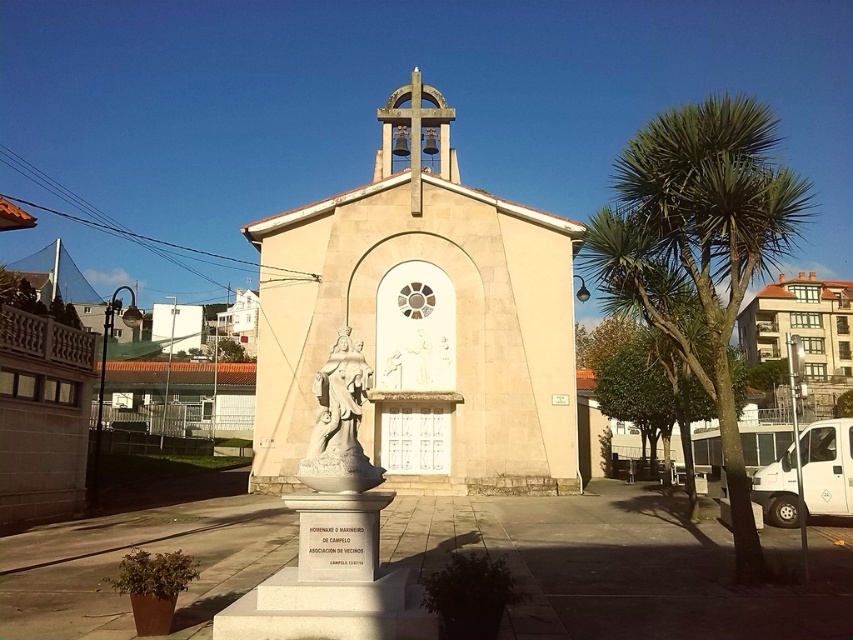
Does green leafy palm tree at right have a greater width compared to beige stone church at center?

No.

Does green leafy palm tree at right have a smaller size compared to beige stone church at center?

No, green leafy palm tree at right is not smaller than beige stone church at center.

This screenshot has width=853, height=640. What do you see at coordinates (700, 250) in the screenshot?
I see `green leafy palm tree at right` at bounding box center [700, 250].

Locate an element on the screen. green leafy palm tree at right is located at coordinates (700, 250).

Is green leafy palm tree at right wider than white stone statue at center?

Yes.

Does green leafy palm tree at right appear over white stone statue at center?

Indeed, green leafy palm tree at right is positioned over white stone statue at center.

What do you see at coordinates (700, 250) in the screenshot?
I see `green leafy palm tree at right` at bounding box center [700, 250].

Identify the location of green leafy palm tree at right. The height and width of the screenshot is (640, 853). (700, 250).

Which is above, beige stone chapel at center or beige stone church at center?

beige stone church at center

Is the position of beige stone chapel at center more distant than that of beige stone church at center?

→ No, it is in front of beige stone church at center.

What do you see at coordinates (422, 321) in the screenshot? Image resolution: width=853 pixels, height=640 pixels. I see `beige stone chapel at center` at bounding box center [422, 321].

Find the location of a particular element. The image size is (853, 640). beige stone chapel at center is located at coordinates (422, 321).